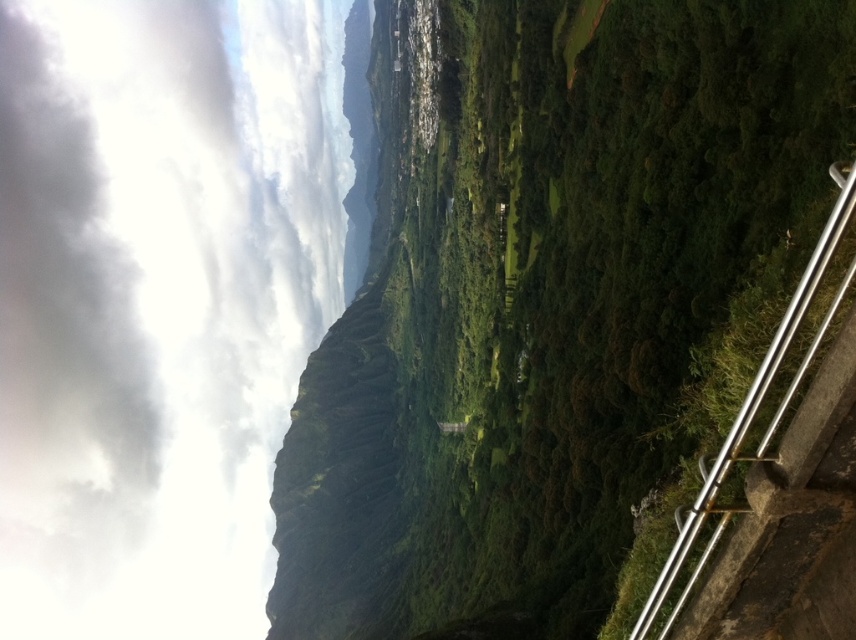
In the scene shown: You are a landscape photographer planning to capture the entire scene from this vantage point. Considering the green leafy vegetation at right and the silver metallic rail at right, which object might require more careful framing to ensure it doesn not overpower the composition?

The green leafy vegetation at right is larger in size than the silver metallic rail at right, so it might require more careful framing to ensure it doesn not overpower the composition.

You are standing at the viewpoint and want to determine the relative positions of two points marked in the image. Which point, point (750, 106) or point (827, 257), is closer to you?

Point (750, 106) is closer to you than point (827, 257) because it is further to the viewer according to the description.

You are standing at the scenic overlook and notice the green leafy vegetation at right and the silver metallic rail at right. Which object is positioned closer to the left side of your view?

Result: The green leafy vegetation at right is to the left of the silver metallic rail at right, so it is closer to the left side of your view.